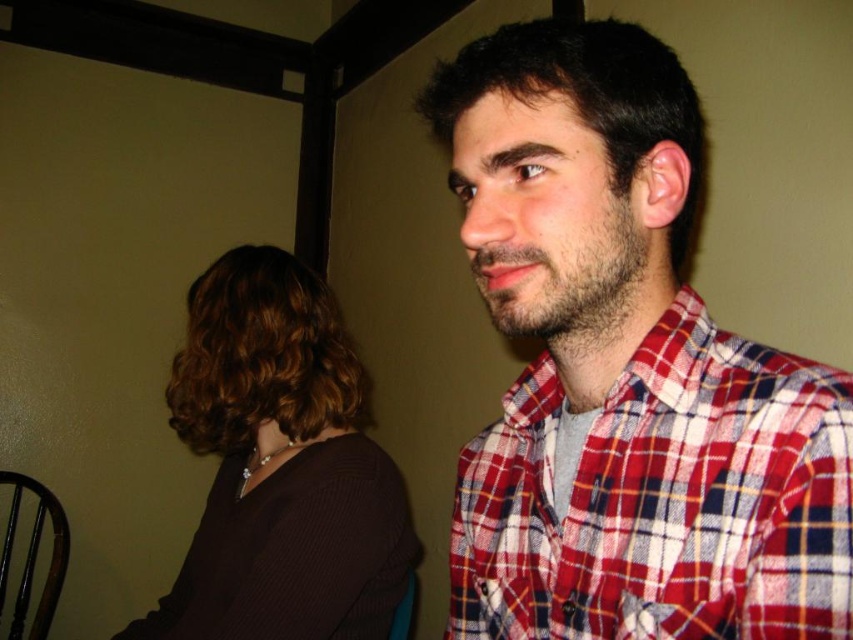
Question: Among these objects, which one is farthest from the camera?

Choices:
 (A) brown matte hair at upper left
 (B) plaid fabric shirt at center

Answer: (A)

Question: Which point is closer to the camera?

Choices:
 (A) (540, 81)
 (B) (396, 572)

Answer: (A)

Question: Which point is closer to the camera?

Choices:
 (A) plaid fabric shirt at center
 (B) brown matte hair at upper left

Answer: (A)

Question: Observing the image, what is the correct spatial positioning of plaid fabric shirt at center in reference to brown matte hair at upper left?

Choices:
 (A) right
 (B) left

Answer: (A)

Question: Does plaid fabric shirt at center appear on the right side of brown matte hair at upper left?

Choices:
 (A) no
 (B) yes

Answer: (B)

Question: Can you confirm if plaid fabric shirt at center is bigger than brown matte hair at upper left?

Choices:
 (A) no
 (B) yes

Answer: (A)